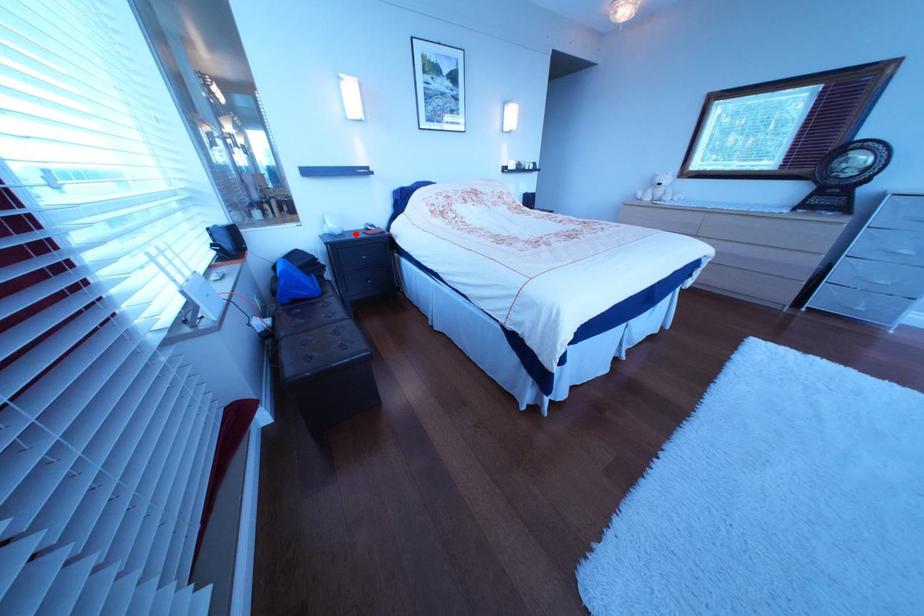
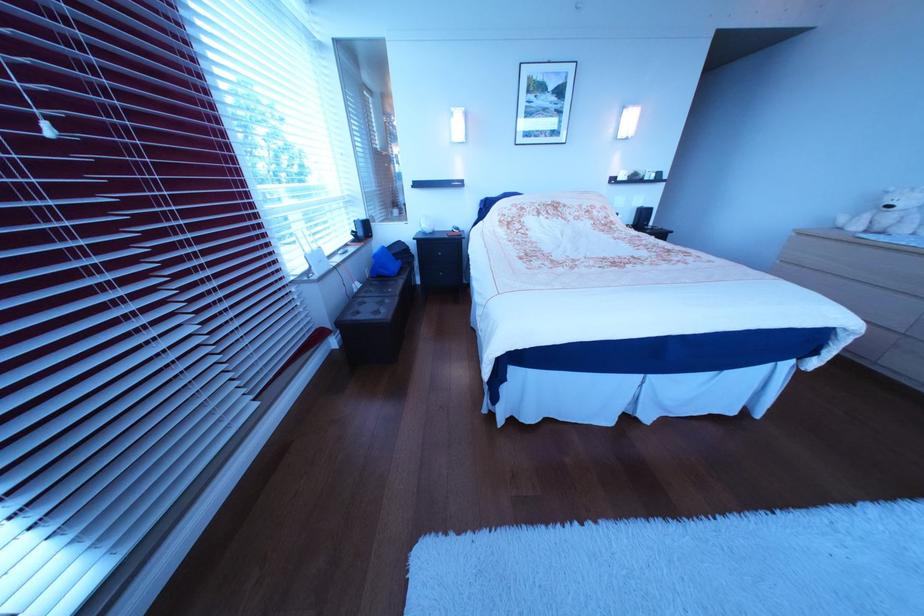
Question: I am providing you with two images of the same scene from different viewpoints. In image1, a red point is highlighted. Considering the same 3D point in image2, which of the following is correct?

Choices:
 (A) It is closer
 (B) It is farther

Answer: (A)